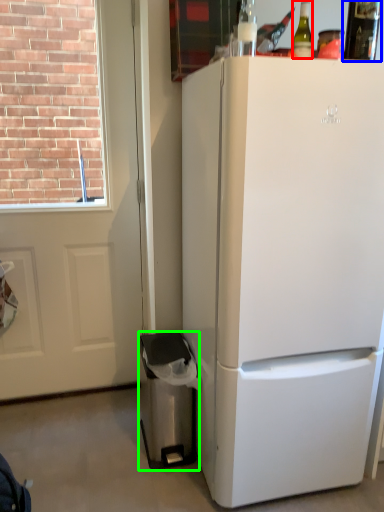
Question: Considering the real-world distances, which object is closest to bottle (highlighted by a red box)? bottle (highlighted by a blue box) or trash bin/can (highlighted by a green box).

Choices:
 (A) bottle
 (B) trash bin/can

Answer: (A)